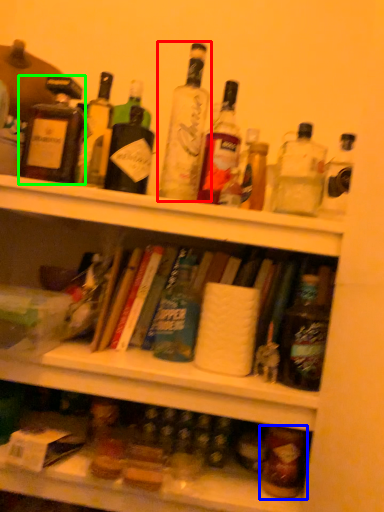
Question: Based on their relative distances, which object is nearer to bottle (highlighted by a red box)? Choose from bottle (highlighted by a blue box) and bottle (highlighted by a green box).

Choices:
 (A) bottle
 (B) bottle

Answer: (B)